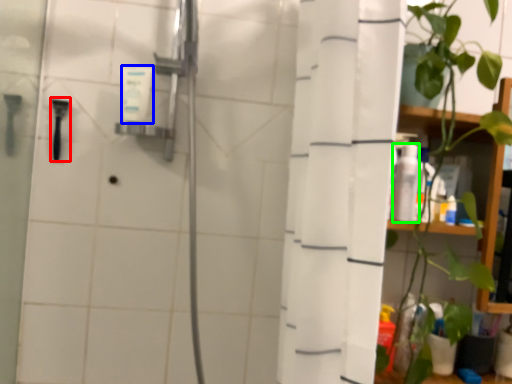
Question: Based on their relative distances, which object is nearer to shower (highlighted by a red box)? Choose from toiletry (highlighted by a blue box) and toiletry (highlighted by a green box).

Choices:
 (A) toiletry
 (B) toiletry

Answer: (A)